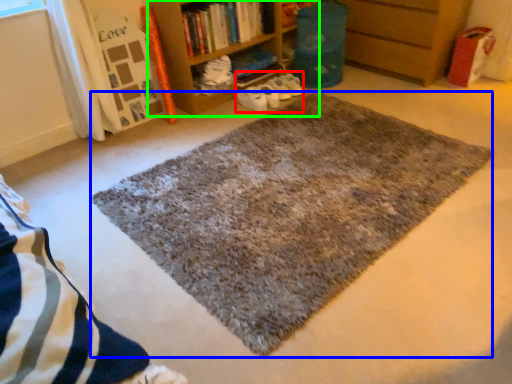
Question: Considering the real-world distances, which object is farthest from shoe (highlighted by a red box)? mat (highlighted by a blue box) or bookcase (highlighted by a green box)?

Choices:
 (A) mat
 (B) bookcase

Answer: (A)